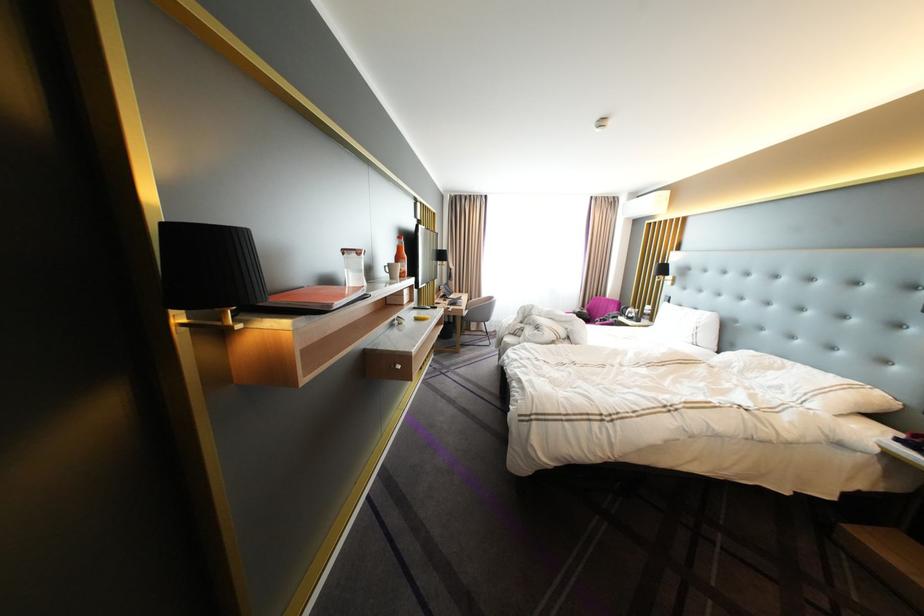
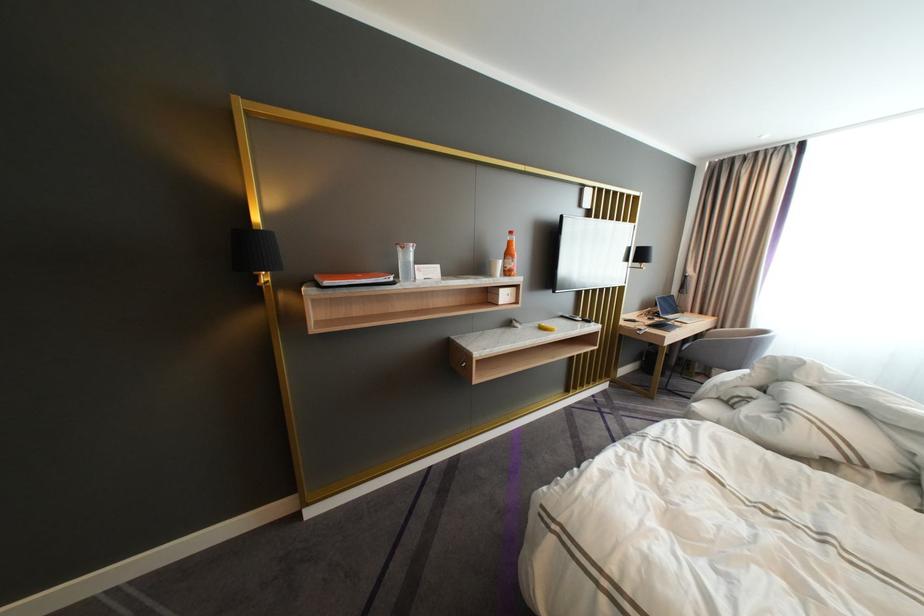
Question: How did the camera likely rotate?

Choices:
 (A) Left
 (B) Right
 (C) Up
 (D) Down

Answer: (A)